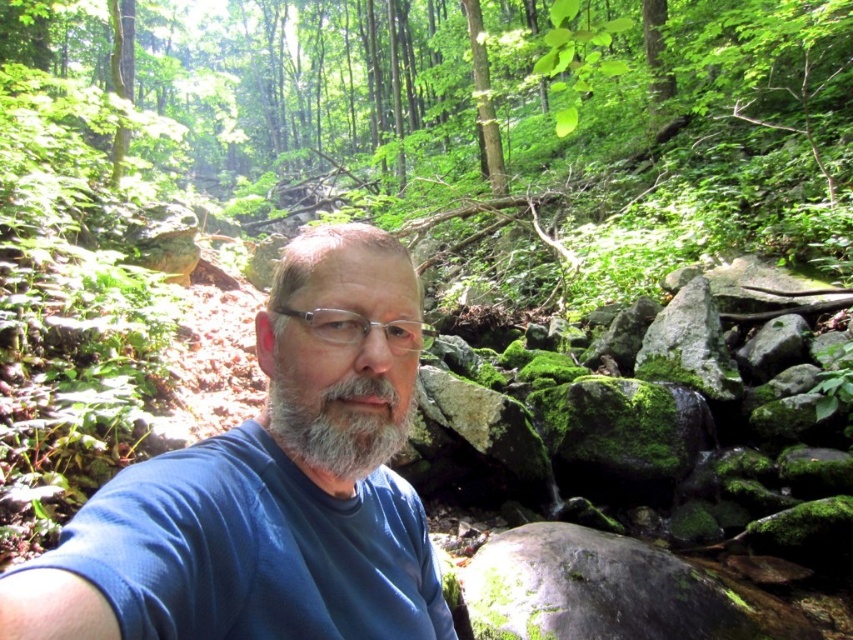
Which is more to the right, blue fabric shirt at center or clear plastic glasses at center?

clear plastic glasses at center

Is blue fabric shirt at center smaller than clear plastic glasses at center?

Yes, blue fabric shirt at center is smaller than clear plastic glasses at center.

The image size is (853, 640). What are the coordinates of `blue fabric shirt at center` in the screenshot? It's located at (265, 492).

Is gray matte beard at center to the right of clear plastic glasses at center from the viewer's perspective?

Yes, gray matte beard at center is to the right of clear plastic glasses at center.

In order to click on gray matte beard at center in this screenshot , I will do (339, 413).

Does blue fabric shirt at center lie in front of gray matte beard at center?

Yes, blue fabric shirt at center is closer to the viewer.

Does point (438, 620) lie behind point (344, 456)?

Yes.

Between point (314, 404) and point (378, 392), which one is positioned behind?

The point (314, 404) is more distant.

Where is `blue fabric shirt at center`? This screenshot has height=640, width=853. blue fabric shirt at center is located at coordinates (265, 492).